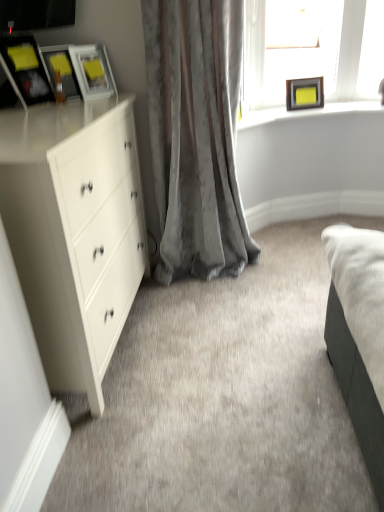
Question: Is matte white picture frame at upper left, which is the 2th picture frame from right to left, positioned in front of matte wooden frame at upper right?

Choices:
 (A) no
 (B) yes

Answer: (B)

Question: Can you confirm if matte white picture frame at upper left, which is the 2th picture frame from right to left, is taller than matte wooden frame at upper right?

Choices:
 (A) no
 (B) yes

Answer: (B)

Question: Can you confirm if matte white picture frame at upper left, which is the 2th picture frame from right to left, is thinner than matte wooden frame at upper right?

Choices:
 (A) yes
 (B) no

Answer: (A)

Question: Can matte wooden frame at upper right be found inside matte white picture frame at upper left, the second picture frame when ordered from back to front?

Choices:
 (A) no
 (B) yes

Answer: (A)

Question: Can you confirm if matte white picture frame at upper left, placed as the 3th picture frame when sorted from front to back, is bigger than matte wooden frame at upper right?

Choices:
 (A) no
 (B) yes

Answer: (A)

Question: From a real-world perspective, is matte white picture frame at upper left, which is the 3th picture frame from left to right, physically below matte wooden frame at upper right?

Choices:
 (A) no
 (B) yes

Answer: (A)

Question: From the image's perspective, would you say matte black picture frame at upper left, which appears as the fourth picture frame when viewed from the right, is positioned over clear glass frame at upper right?

Choices:
 (A) yes
 (B) no

Answer: (B)

Question: From a real-world perspective, does matte black picture frame at upper left, which appears as the fourth picture frame when viewed from the right, sit lower than clear glass frame at upper right?

Choices:
 (A) no
 (B) yes

Answer: (A)

Question: Is matte black picture frame at upper left, which ranks as the first picture frame in left-to-right order, to the left of clear glass frame at upper right from the viewer's perspective?

Choices:
 (A) no
 (B) yes

Answer: (B)

Question: Is matte black picture frame at upper left, which ranks as the first picture frame in left-to-right order, at the right side of clear glass frame at upper right?

Choices:
 (A) yes
 (B) no

Answer: (B)

Question: Is matte black picture frame at upper left, which appears as the fourth picture frame when viewed from the right, placed right next to clear glass frame at upper right?

Choices:
 (A) yes
 (B) no

Answer: (B)

Question: Is matte black picture frame at upper left, which appears as the fourth picture frame when viewed from the right, facing towards clear glass frame at upper right?

Choices:
 (A) no
 (B) yes

Answer: (A)

Question: Is matte wooden frame at upper right wider than clear glass frame at upper right?

Choices:
 (A) no
 (B) yes

Answer: (B)